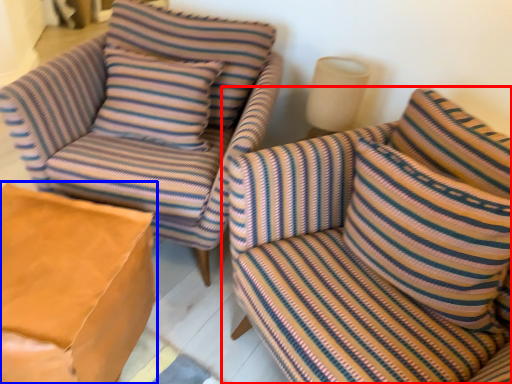
Question: Which of the following is the closest to the observer, studio couch (highlighted by a red box) or table (highlighted by a blue box)?

Choices:
 (A) studio couch
 (B) table

Answer: (A)